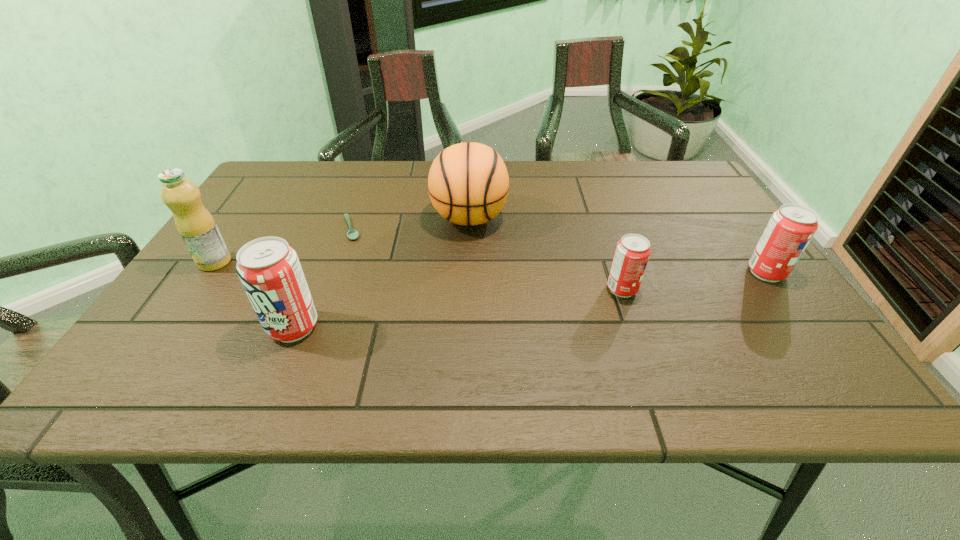
Where is `free location located on the left of the second soda can from right to left`? free location located on the left of the second soda can from right to left is located at coordinates tap(461, 289).

You are a GUI agent. You are given a task and a screenshot of the screen. Output one action in this format:
    pyautogui.click(x=<x>, y=<y>)
    Task: Click on the vacant region located on the left of the rightmost object
    
    Given the screenshot: What is the action you would take?
    pyautogui.click(x=647, y=273)

Locate an element on the screen. free spot located on the front of the basketball is located at coordinates (468, 271).

At what (x,y) coordinates should I click in order to perform the action: click on vacant space located on the front label of the fruit juice. Please return your answer as a coordinate pair (x, y). Image resolution: width=960 pixels, height=540 pixels. Looking at the image, I should click on (161, 340).

Locate an element on the screen. This screenshot has width=960, height=540. free space located on the back of the shortest object is located at coordinates (367, 188).

Image resolution: width=960 pixels, height=540 pixels. Identify the location of object positioned at the far edge. coord(468,183).

This screenshot has width=960, height=540. What are the coordinates of `object that is at the near edge` in the screenshot? It's located at (269, 269).

Locate an element on the screen. The height and width of the screenshot is (540, 960). object present at the left edge is located at coordinates (195, 224).

Locate an element on the screen. Image resolution: width=960 pixels, height=540 pixels. object at the right edge is located at coordinates (790, 229).

This screenshot has height=540, width=960. I want to click on blank space at the far edge, so click(410, 165).